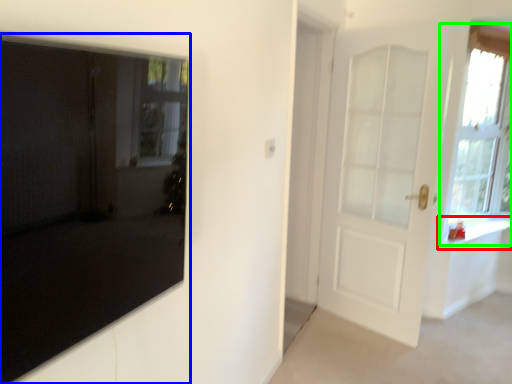
Question: Based on their relative distances, which object is nearer to window sill (highlighted by a red box)? Choose from door (highlighted by a blue box) and window (highlighted by a green box).

Choices:
 (A) door
 (B) window

Answer: (B)